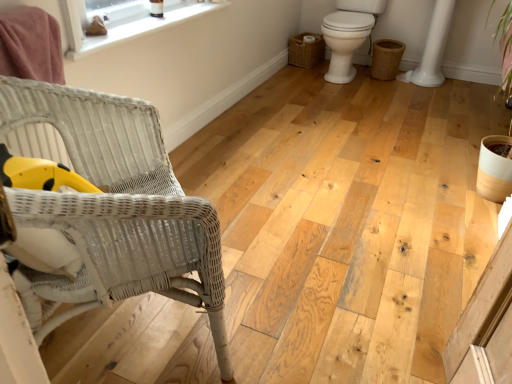
Question: Is white wicker chair at left at the back of white glossy toilet at right?

Choices:
 (A) no
 (B) yes

Answer: (A)

Question: Is the position of white glossy toilet at right less distant than that of white wicker chair at left?

Choices:
 (A) yes
 (B) no

Answer: (B)

Question: Can you confirm if white glossy toilet at right is shorter than white wicker chair at left?

Choices:
 (A) no
 (B) yes

Answer: (B)

Question: Considering the relative sizes of white glossy toilet at right and white wicker chair at left in the image provided, is white glossy toilet at right smaller than white wicker chair at left?

Choices:
 (A) yes
 (B) no

Answer: (A)

Question: From the image's perspective, would you say white glossy toilet at right is positioned over white wicker chair at left?

Choices:
 (A) yes
 (B) no

Answer: (A)

Question: From the image's perspective, is braided wicker basket at lower right, the second basket when ordered from left to right, positioned above or below white glossy toilet at right?

Choices:
 (A) below
 (B) above

Answer: (A)

Question: From a real-world perspective, relative to white glossy toilet at right, is braided wicker basket at lower right, the second basket when ordered from left to right, vertically above or below?

Choices:
 (A) below
 (B) above

Answer: (A)

Question: Considering the positions of braided wicker basket at lower right, the second basket when ordered from left to right, and white glossy toilet at right in the image, is braided wicker basket at lower right, the second basket when ordered from left to right, wider or thinner than white glossy toilet at right?

Choices:
 (A) thin
 (B) wide

Answer: (A)

Question: Considering their positions, is braided wicker basket at lower right, positioned as the 1th basket in right-to-left order, located in front of or behind white glossy toilet at right?

Choices:
 (A) front
 (B) behind

Answer: (B)

Question: Is braided wicker basket at lower right, positioned as the 1th basket in right-to-left order, wider or thinner than white wicker chair at left?

Choices:
 (A) wide
 (B) thin

Answer: (B)

Question: From a real-world perspective, is braided wicker basket at lower right, the second basket when ordered from left to right, above or below white wicker chair at left?

Choices:
 (A) above
 (B) below

Answer: (B)

Question: In the image, is braided wicker basket at lower right, positioned as the 1th basket in right-to-left order, on the left side or the right side of white wicker chair at left?

Choices:
 (A) right
 (B) left

Answer: (A)

Question: Is braided wicker basket at lower right, the second basket when ordered from left to right, inside the boundaries of white wicker chair at left, or outside?

Choices:
 (A) outside
 (B) inside

Answer: (A)

Question: From the image's perspective, is white wicker chair at left positioned above or below braided wicker basket at lower right, positioned as the 1th basket in right-to-left order?

Choices:
 (A) above
 (B) below

Answer: (B)

Question: Is white wicker chair at left inside or outside of braided wicker basket at lower right, the second basket when ordered from left to right?

Choices:
 (A) inside
 (B) outside

Answer: (B)